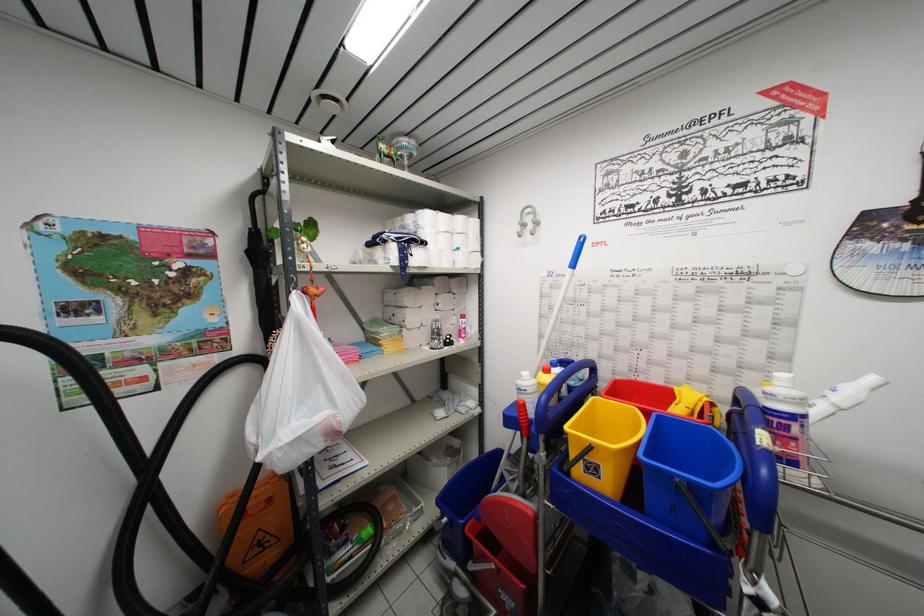
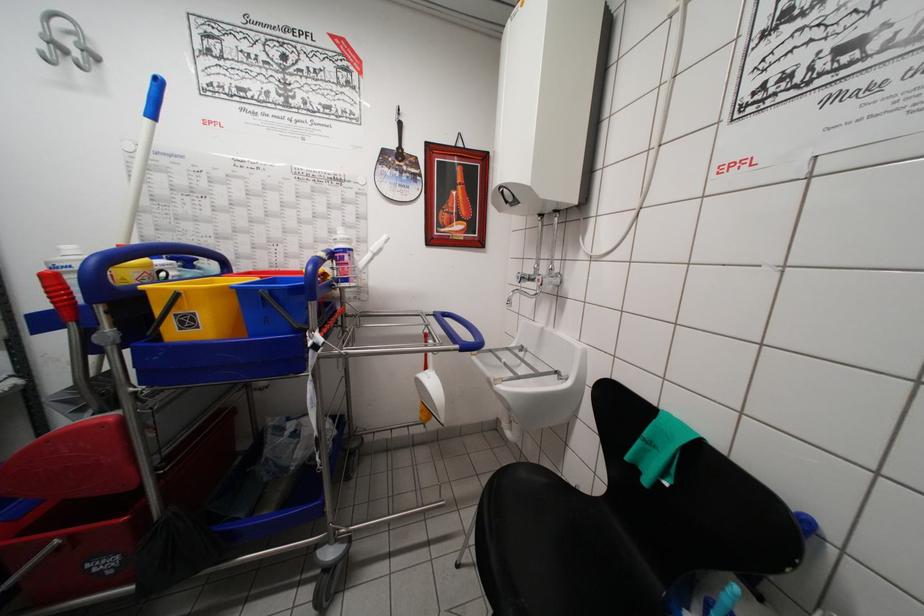
Question: Based on the continuous images, in which direction is the camera rotating? Reply with the corresponding letter.

Choices:
 (A) Left
 (B) Right
 (C) Up
 (D) Down

Answer: (B)